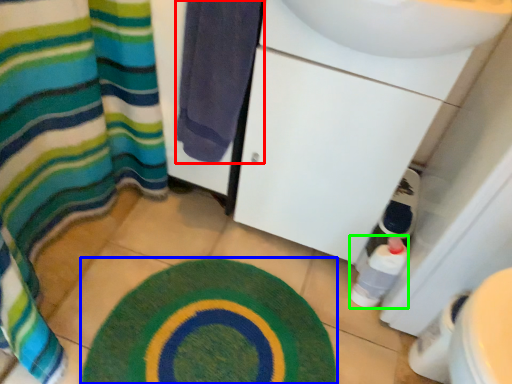
Question: Considering the real-world distances, which object is farthest from towel (highlighted by a red box)? bath mat (highlighted by a blue box) or bottle (highlighted by a green box)?

Choices:
 (A) bath mat
 (B) bottle

Answer: (B)